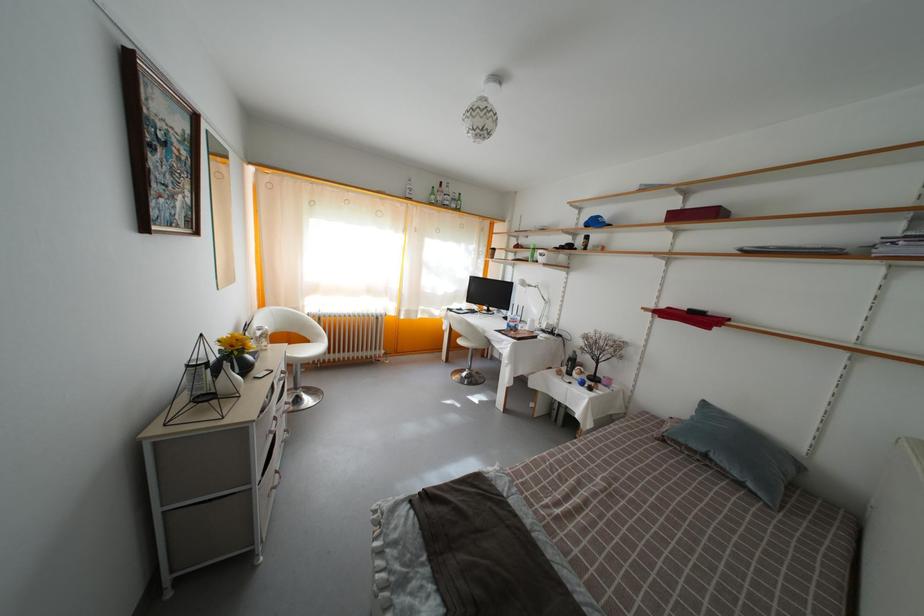
Where is `white desk lamp`? The height and width of the screenshot is (616, 924). white desk lamp is located at coordinates (535, 305).